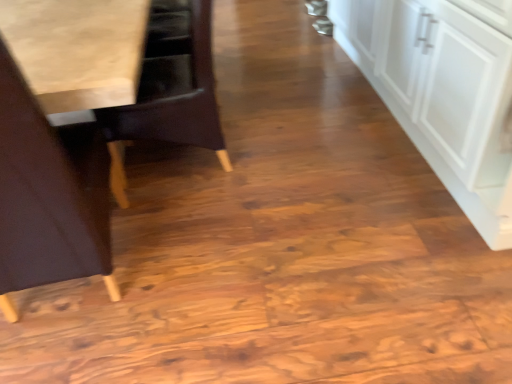
Question: Looking at their shapes, would you say wooden chair at left, positioned as the first chair in back-to-front order, is wider or thinner than white matte cabinet at right?

Choices:
 (A) wide
 (B) thin

Answer: (B)

Question: Is wooden chair at left, which is the 2th chair from front to back, situated inside white matte cabinet at right or outside?

Choices:
 (A) inside
 (B) outside

Answer: (B)

Question: Which is nearer to the wooden chair at left, positioned as the first chair in back-to-front order?

Choices:
 (A) light brown wood chair at left, arranged as the first chair when viewed from the front
 (B) white matte cabinet at right

Answer: (A)

Question: Which is farther from the light brown wood chair at left, arranged as the first chair when viewed from the front?

Choices:
 (A) white matte cabinet at right
 (B) wooden chair at left, which is the 2th chair from front to back

Answer: (A)